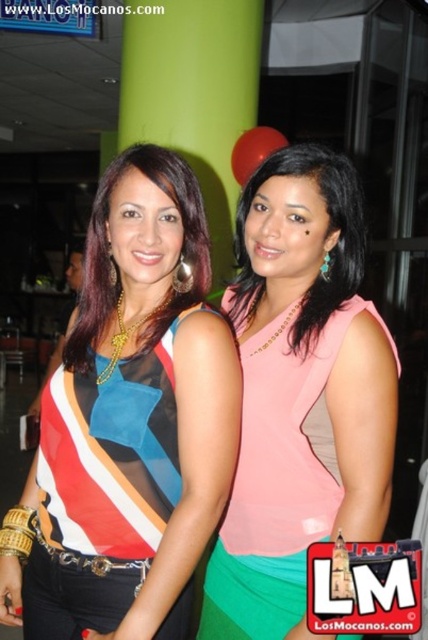
Question: Which point is closer to the camera?

Choices:
 (A) matte multicolored top at center
 (B) pink fabric dress at center
 (C) pink matte dress at center

Answer: (B)

Question: Which is farther from the pink matte dress at center?

Choices:
 (A) multicolored sheer top at center
 (B) pink fabric dress at center
 (C) matte multicolored top at center

Answer: (A)

Question: Does pink fabric dress at center have a greater width compared to matte multicolored top at center?

Choices:
 (A) no
 (B) yes

Answer: (B)

Question: Can you confirm if multicolored sheer top at center is positioned above pink fabric dress at center?

Choices:
 (A) no
 (B) yes

Answer: (B)

Question: Which is nearer to the multicolored sheer top at center?

Choices:
 (A) pink fabric dress at center
 (B) pink matte dress at center

Answer: (A)

Question: Can you confirm if multicolored sheer top at center is smaller than pink matte dress at center?

Choices:
 (A) yes
 (B) no

Answer: (B)